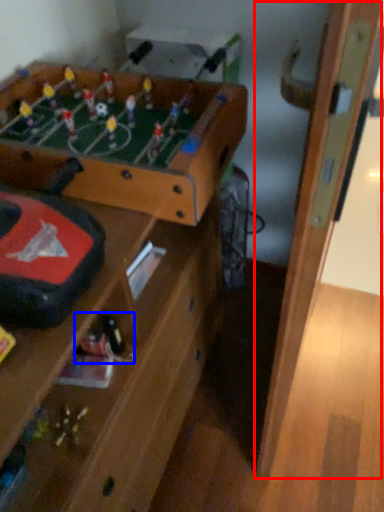
Question: Which of the following is the closest to the observer, door (highlighted by a red box) or toy (highlighted by a blue box)?

Choices:
 (A) door
 (B) toy

Answer: (A)